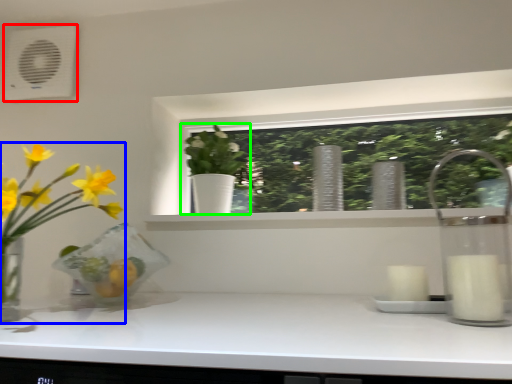
Question: Which object is the closest to the air conditioning (highlighted by a red box)? Choose among these: houseplant (highlighted by a blue box) or houseplant (highlighted by a green box).

Choices:
 (A) houseplant
 (B) houseplant

Answer: (A)